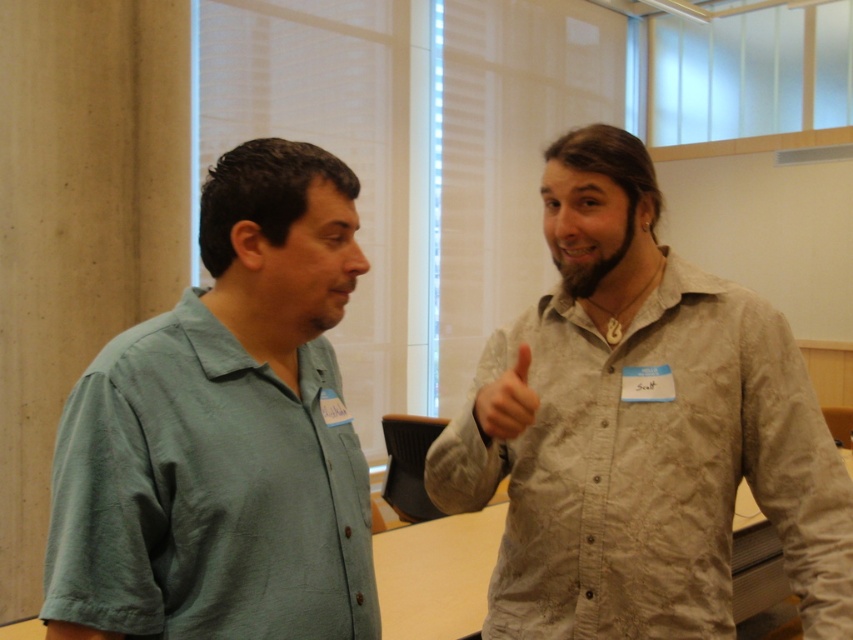
You are a photographer trying to capture a candid shot of the light brown textured shirt at upper right and the matte skin hand at upper right. Based on their positions, which object is positioned to the right side of the other?

The light brown textured shirt at upper right is positioned to the right side of the matte skin hand at upper right.

You are a photographer positioned at the entrance of the room. You need to capture a photo that includes both the light brown textured shirt at upper right and the matte skin hand at upper right. Based on their positions, which object should be placed on the left side of the photo frame?

The matte skin hand at upper right should be placed on the left side of the photo frame because the light brown textured shirt at upper right is positioned to the right of it.

You are a photographer setting up for a group photo. You need to ensure that the green cotton shirt at left and the matte skin hand at upper right are both visible in the frame. Given their sizes, which object should you prioritize keeping centered to avoid being cut off?

The green cotton shirt at left is bigger than the matte skin hand at upper right, so you should prioritize keeping the green cotton shirt at left centered to avoid being cut off.